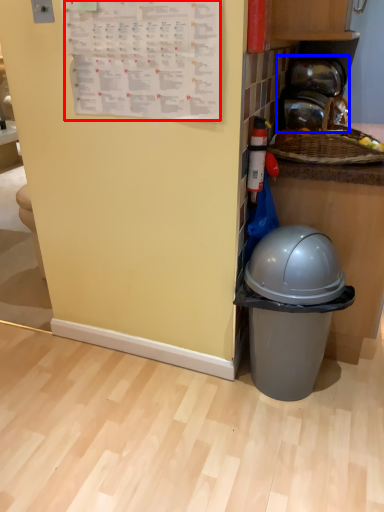
Question: Which object appears closest to the camera in this image, writing (highlighted by a red box) or appliance (highlighted by a blue box)?

Choices:
 (A) writing
 (B) appliance

Answer: (A)